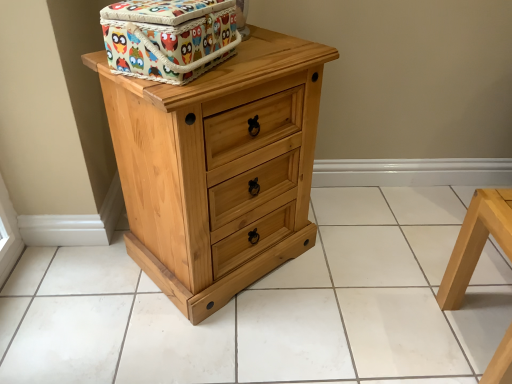
Locate an element on the screen. The height and width of the screenshot is (384, 512). free space to the left of natural wood chest of drawers at center is located at coordinates (76, 289).